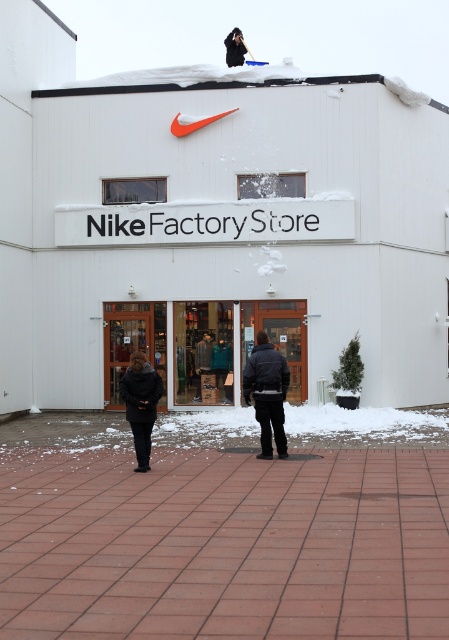
You are at the Nike Factory Store entrance and want to walk towards the point labeled as point (199, 397). If you continue straight, will you pass by the point labeled as point (221, 353) first?

Point (221, 353) is behind point (199, 397), so if you walk straight towards point (199, 397), you will reach it first before passing by point (221, 353).

Looking at this image, you are a delivery person trying to locate the dark gray fabric coat at center in the image of the Nike Factory Store. According to the coordinates provided, where would you find it?

The dark gray fabric coat at center is located at point (268, 392).